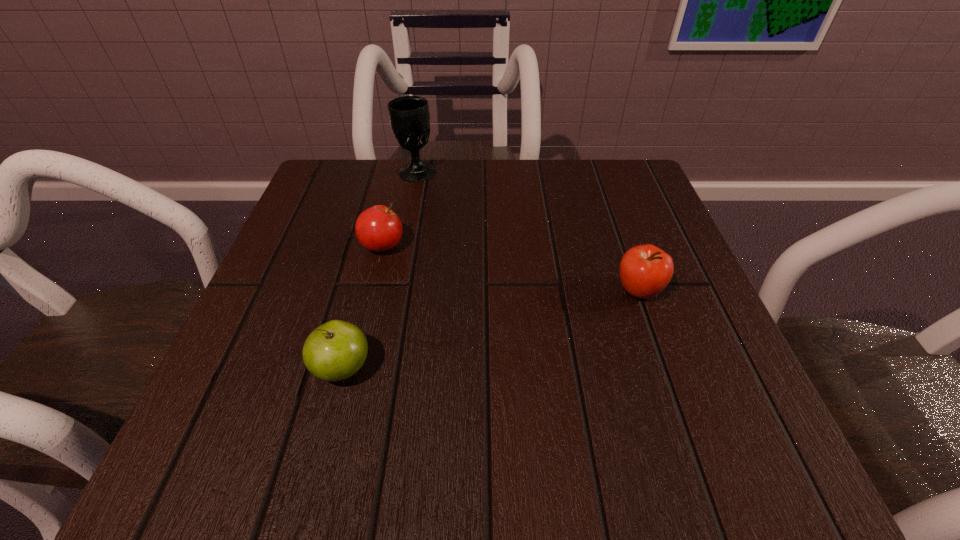
Locate which object is the closest to the tallest object. Please provide its 2D coordinates. Your answer should be formatted as a tuple, i.e. [(x, y)], where the tuple contains the x and y coordinates of a point satisfying the conditions above.

[(378, 228)]

Identify which object is located as the second nearest to the tallest object. Please provide its 2D coordinates. Your answer should be formatted as a tuple, i.e. [(x, y)], where the tuple contains the x and y coordinates of a point satisfying the conditions above.

[(645, 270)]

Select which apple appears as the second closest to the nearest apple. Please provide its 2D coordinates. Your answer should be formatted as a tuple, i.e. [(x, y)], where the tuple contains the x and y coordinates of a point satisfying the conditions above.

[(645, 270)]

You are a GUI agent. You are given a task and a screenshot of the screen. Output one action in this format:
    pyautogui.click(x=<x>, y=<y>)
    Task: Click on the apple identified as the second closest to the tallest object
    Image resolution: width=960 pixels, height=540 pixels.
    Given the screenshot: What is the action you would take?
    click(x=645, y=270)

Where is `free space that satisfies the following two spatial constraints: 1. on the front side of the tallest object; 2. on the left side of the rightmost object`? This screenshot has height=540, width=960. free space that satisfies the following two spatial constraints: 1. on the front side of the tallest object; 2. on the left side of the rightmost object is located at coordinates (395, 291).

Locate an element on the screen. free region that satisfies the following two spatial constraints: 1. on the back side of the second nearest object; 2. on the left side of the nearest apple is located at coordinates (363, 291).

You are a GUI agent. You are given a task and a screenshot of the screen. Output one action in this format:
    pyautogui.click(x=<x>, y=<y>)
    Task: Click on the free location that satisfies the following two spatial constraints: 1. on the back side of the nearest apple; 2. on the right side of the third nearest object
    The width and height of the screenshot is (960, 540).
    Given the screenshot: What is the action you would take?
    pyautogui.click(x=374, y=246)

Locate an element on the screen. free space that satisfies the following two spatial constraints: 1. on the front side of the rightmost apple; 2. on the left side of the tallest object is located at coordinates (395, 291).

I want to click on free spot that satisfies the following two spatial constraints: 1. on the back side of the second nearest object; 2. on the right side of the nearest apple, so click(x=363, y=291).